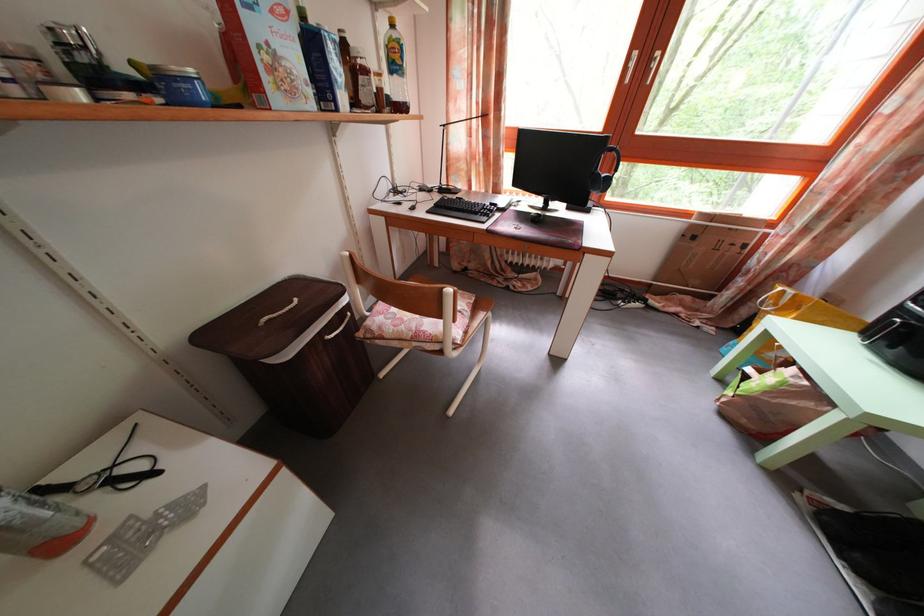
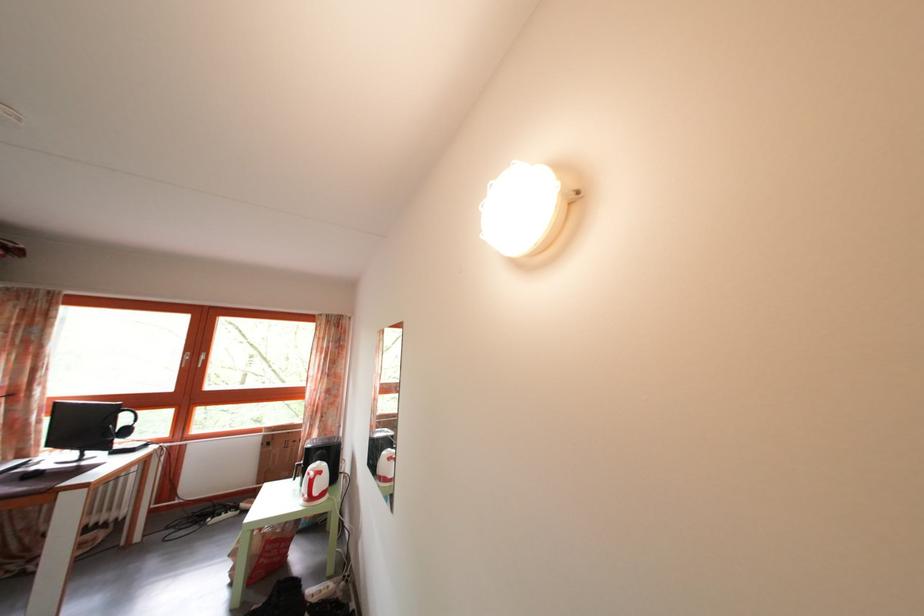
Find the pixel in the second image that matches the point at 629,298 in the first image.

(233, 514)